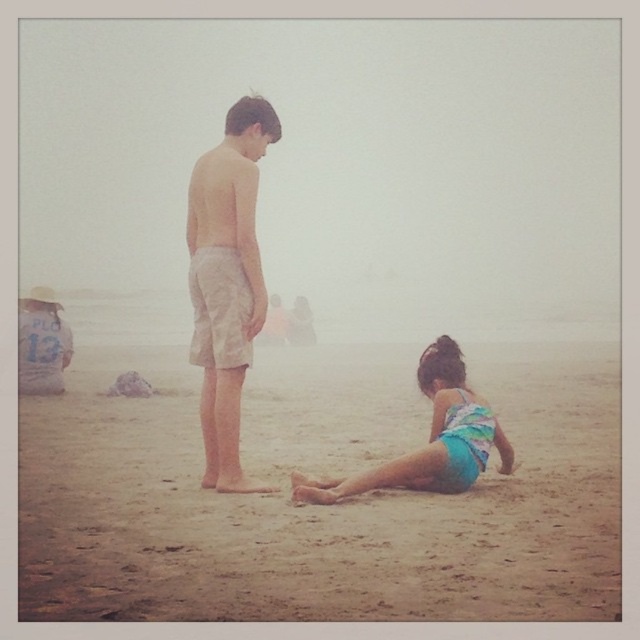
Is fine-grained sand at lower center closer to the viewer compared to teal swimsuit at lower right?

That is True.

Does fine-grained sand at lower center come behind teal swimsuit at lower right?

No.

Who is more forward, (x=278, y=448) or (x=458, y=364)?

Point (x=458, y=364) is in front.

Where is `fine-grained sand at lower center`? The image size is (640, 640). fine-grained sand at lower center is located at coordinates tap(317, 509).

Between fine-grained sand at lower center and beige cotton shorts at center, which one is positioned higher?

beige cotton shorts at center is above.

Measure the distance between point (115,502) and camera.

Point (115,502) is 6.61 meters away from camera.

Locate an element on the screen. This screenshot has height=640, width=640. fine-grained sand at lower center is located at coordinates (317, 509).

At what (x,y) coordinates should I click in order to perform the action: click on fine-grained sand at lower center. Please return your answer as a coordinate pair (x, y). Looking at the image, I should click on (317, 509).

Is beige cotton shorts at center below teal swimsuit at lower right?

Actually, beige cotton shorts at center is above teal swimsuit at lower right.

Find the location of a particular element. Image resolution: width=640 pixels, height=640 pixels. beige cotton shorts at center is located at coordinates (227, 280).